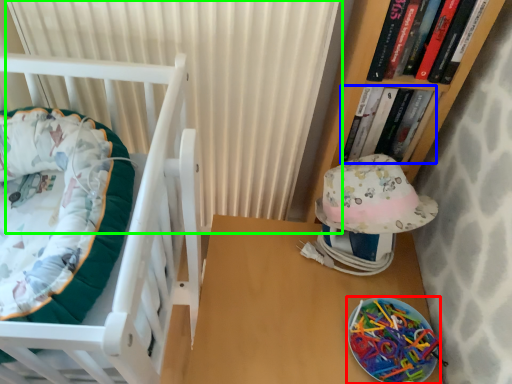
Question: Based on their relative distances, which object is nearer to glass plate (highlighted by a red box)? Choose from book (highlighted by a blue box) and curtain (highlighted by a green box).

Choices:
 (A) book
 (B) curtain

Answer: (A)